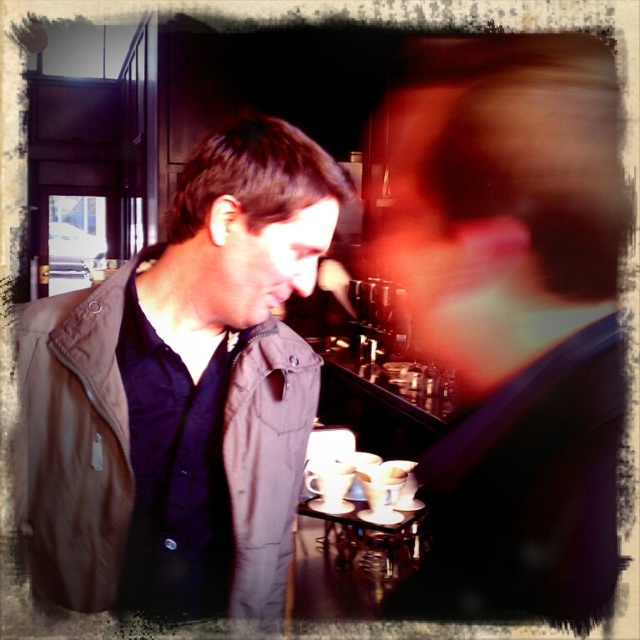
You are a barista working behind the counter in the image. You need to reach both the smooth brown jacket at center and the brown fabric jacket at left to hand them their orders. Given that your maximum reach is 1.4 meters, can you comfortably hand both jackets their drinks without moving your position?

A: The smooth brown jacket at center is 1.50 meters from the brown fabric jacket at left, which exceeds your 1.4 meter reach. Therefore, you cannot comfortably hand both jackets their drinks without moving your position.

In the scene shown: You are standing in the center of the room and want to place a small decorative item on the counter where the smooth brown jacket at center is located. Given the coordinates provided, can you determine if there is enough space between the jacket and the edge of the counter to place the item?

The smooth brown jacket at center is located at point (x=509, y=316). However, without knowing the dimensions of the counter or the space around the jacket, it is impossible to determine if there is enough space to place the item.

You are a customer in the cafe and you see two jackets hanging on the wall behind the counter. The smooth brown jacket at center and the brown fabric jacket at left. Which one is higher up?

The smooth brown jacket at center is higher up because it is above the brown fabric jacket at left.